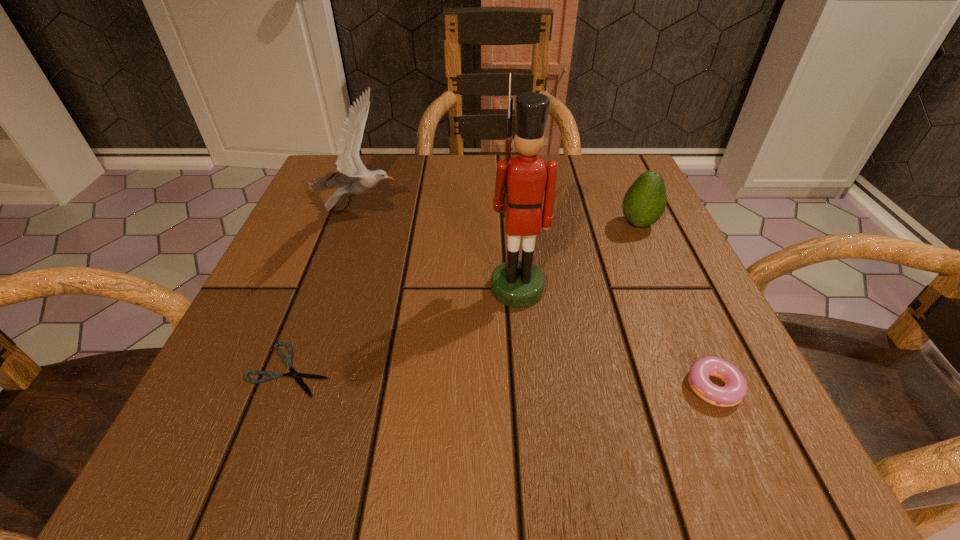
At what (x,y) coordinates should I click in order to perform the action: click on free point at the right edge. Please return your answer as a coordinate pair (x, y). The height and width of the screenshot is (540, 960). Looking at the image, I should click on (700, 311).

Image resolution: width=960 pixels, height=540 pixels. In the image, there is a desktop. Identify the location of free region at the near left corner. (299, 464).

Identify the location of vacant space at the far right corner of the desktop. The width and height of the screenshot is (960, 540). (628, 172).

At what (x,y) coordinates should I click in order to perform the action: click on unoccupied position between the second tallest object and the avocado. Please return your answer as a coordinate pair (x, y). This screenshot has height=540, width=960. Looking at the image, I should click on (500, 217).

In order to click on free point between the third nearest object and the doughnut in this screenshot , I will do `click(618, 338)`.

Image resolution: width=960 pixels, height=540 pixels. I want to click on vacant space that's between the third object from left to right and the fourth shortest object, so click(440, 249).

What are the coordinates of `free space between the shortest object and the third shortest object` in the screenshot? It's located at (465, 296).

Find the location of a particular element. empty space between the shortest object and the third nearest object is located at coordinates [403, 329].

Identify the location of vacant point located between the doughnut and the avocado. This screenshot has width=960, height=540. (679, 305).

Locate an element on the screen. The width and height of the screenshot is (960, 540). unoccupied position between the avocado and the third object from left to right is located at coordinates (578, 256).